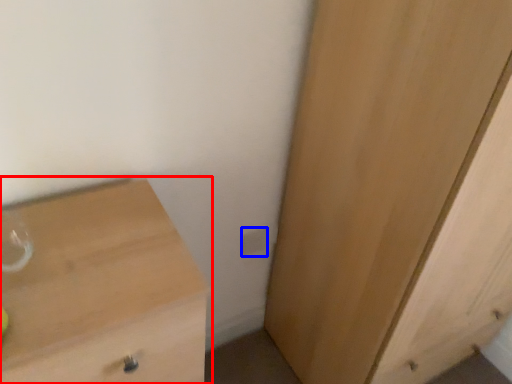
Question: Which object is further to the camera taking this photo, chest of drawers (highlighted by a red box) or electric outlet (highlighted by a blue box)?

Choices:
 (A) chest of drawers
 (B) electric outlet

Answer: (B)